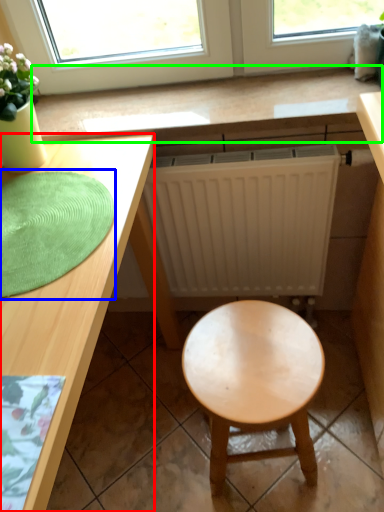
Question: Which object is positioned closest to desk (highlighted by a red box)? Select from mat (highlighted by a blue box) and counter top (highlighted by a green box).

Choices:
 (A) mat
 (B) counter top

Answer: (A)